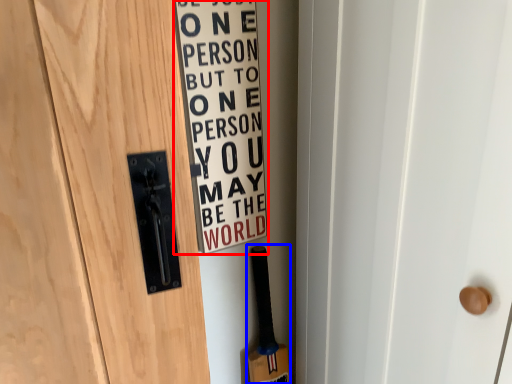
Question: Which point is closer to the camera, warning sign (highlighted by a red box) or baseball bat (highlighted by a blue box)?

Choices:
 (A) warning sign
 (B) baseball bat

Answer: (A)